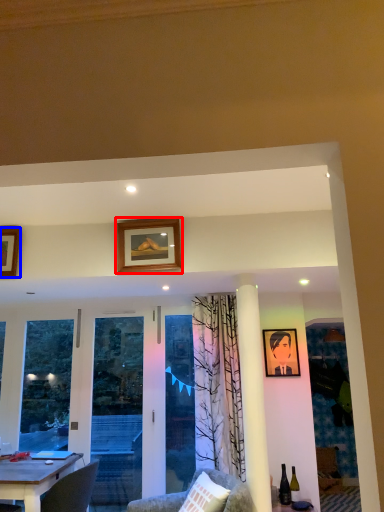
Question: Which of the following is the farthest to the observer, picture frame (highlighted by a red box) or picture frame (highlighted by a blue box)?

Choices:
 (A) picture frame
 (B) picture frame

Answer: (B)